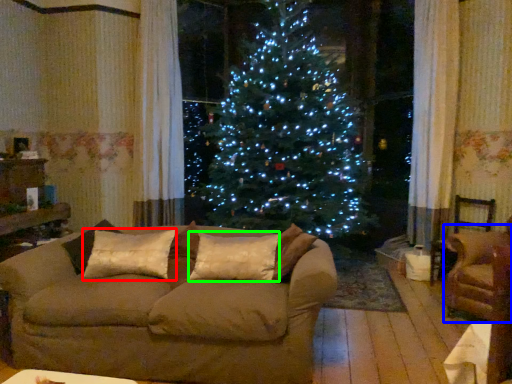
Question: Which object is the closest to the pillow (highlighted by a red box)? Choose among these: armchair (highlighted by a blue box) or pillow (highlighted by a green box).

Choices:
 (A) armchair
 (B) pillow

Answer: (B)